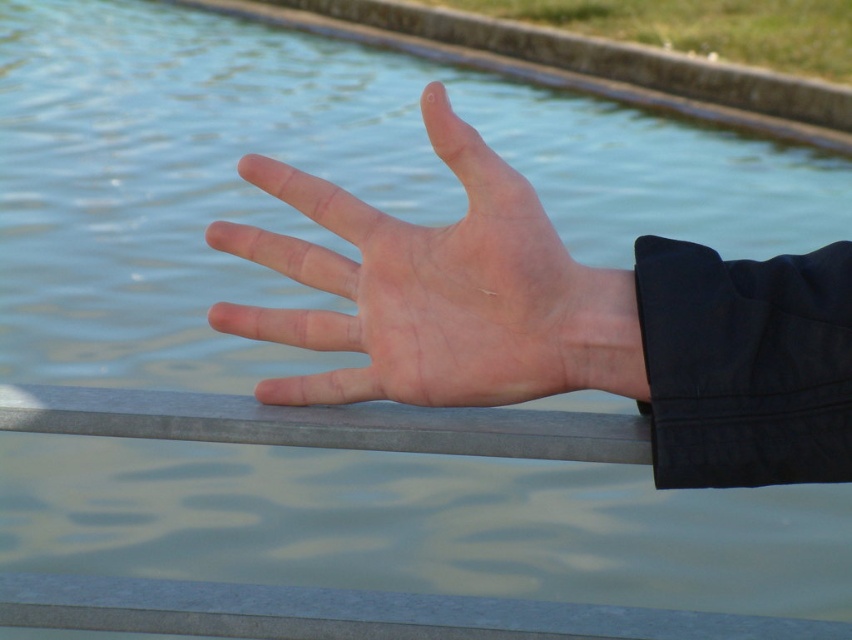
You are a photographer trying to capture the reflection of the water in the background. You notice two hands in the frame, the skinny hand at center and the pale skin hand at center. Which hand might be blocking the reflection more due to its size?

The skinny hand at center is larger in size than the pale skin hand at center, so the skinny hand at center would block more of the reflection.

You are a sculptor observing the hand details in the image. You need to decide which hand to use as a model for a statue. If the skinny hand at center is wider than the pale skin hand at center, which one should you choose for a more realistic depiction of an adult hand?

The skinny hand at center is wider than the pale skin hand at center, so you should choose the skinny hand at center for a more realistic depiction since it matches the description of being wider.